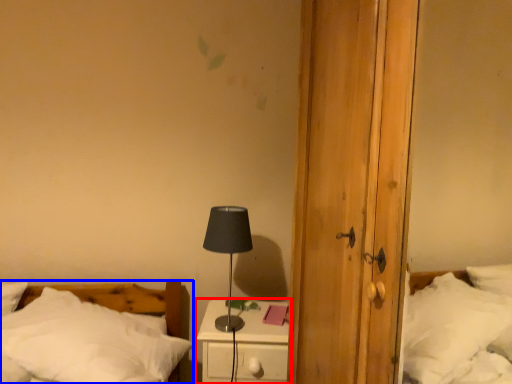
Question: Which point is closer to the camera, nightstand (highlighted by a red box) or bed (highlighted by a blue box)?

Choices:
 (A) nightstand
 (B) bed

Answer: (B)